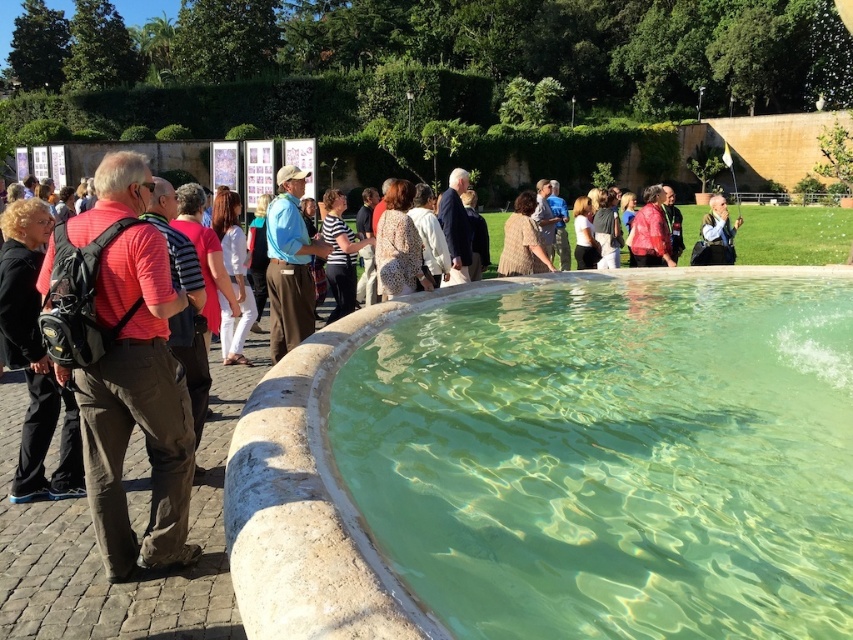
Does clear stone pool at center have a lesser width compared to light blue cotton shirt at center?

Indeed, clear stone pool at center has a lesser width compared to light blue cotton shirt at center.

Who is positioned more to the right, clear stone pool at center or light blue cotton shirt at center?

Positioned to the right is clear stone pool at center.

Is point (648, 275) farther from camera compared to point (293, 225)?

Yes.

You are a GUI agent. You are given a task and a screenshot of the screen. Output one action in this format:
    pyautogui.click(x=<x>, y=<y>)
    Task: Click on the clear stone pool at center
    
    Given the screenshot: What is the action you would take?
    pyautogui.click(x=316, y=499)

Does light blue cotton shirt at center appear over white fabric bag at upper right?

Actually, light blue cotton shirt at center is below white fabric bag at upper right.

Looking at this image, who is more distant from viewer, (x=270, y=276) or (x=714, y=212)?

The point (x=714, y=212) is more distant.

Measure the distance between light blue cotton shirt at center and camera.

light blue cotton shirt at center and camera are 8.72 meters apart from each other.

Find the location of a particular element. The height and width of the screenshot is (640, 853). light blue cotton shirt at center is located at coordinates (289, 264).

Is clear stone pool at center smaller than matte black backpack at left?

Yes, clear stone pool at center is smaller than matte black backpack at left.

Is clear stone pool at center thinner than matte black backpack at left?

Yes.

Who is more distant from viewer, (314, 582) or (117, 371)?

The point (117, 371) is more distant.

What are the coordinates of `clear stone pool at center` in the screenshot? It's located at pos(316,499).